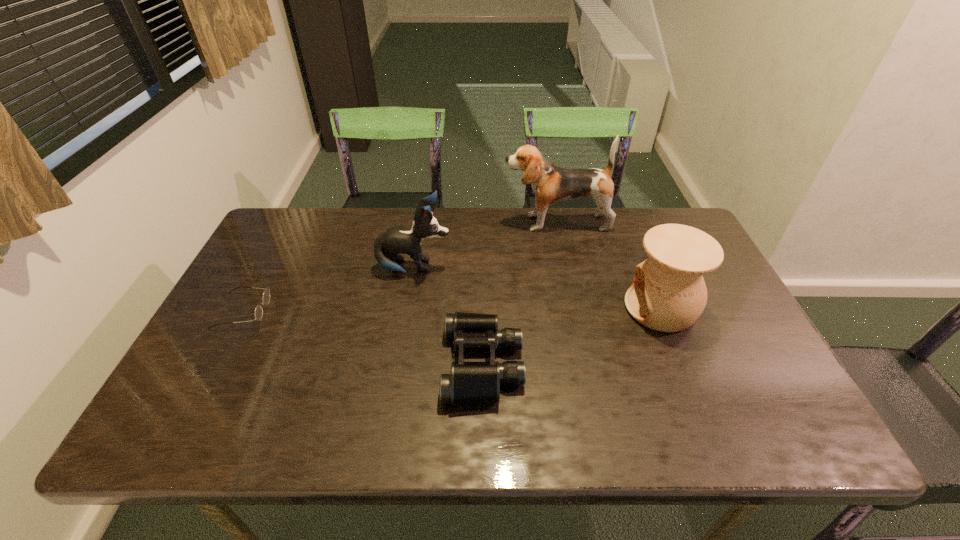
Identify the location of object that is at the near edge. (470, 382).

Locate an element on the screen. object that is at the left edge is located at coordinates (266, 295).

Locate an element on the screen. object that is at the right edge is located at coordinates [668, 294].

Where is `vacant area at the far edge of the desktop`? vacant area at the far edge of the desktop is located at coordinates (382, 213).

The height and width of the screenshot is (540, 960). I want to click on vacant space at the near edge of the desktop, so click(x=640, y=429).

At what (x,y) coordinates should I click in order to perform the action: click on vacant space at the left edge of the desktop. Please return your answer as a coordinate pair (x, y). Looking at the image, I should click on coord(273,255).

Find the location of a particular element. This screenshot has height=540, width=960. free space at the right edge of the desktop is located at coordinates (742, 335).

The image size is (960, 540). What are the coordinates of `free area in between the pottery and the spectacles` in the screenshot? It's located at (451, 309).

This screenshot has height=540, width=960. What are the coordinates of `vacant space in between the pottery and the shorter puppy` in the screenshot? It's located at (538, 288).

Locate an element on the screen. vacant space that is in between the farthest object and the left puppy is located at coordinates (486, 246).